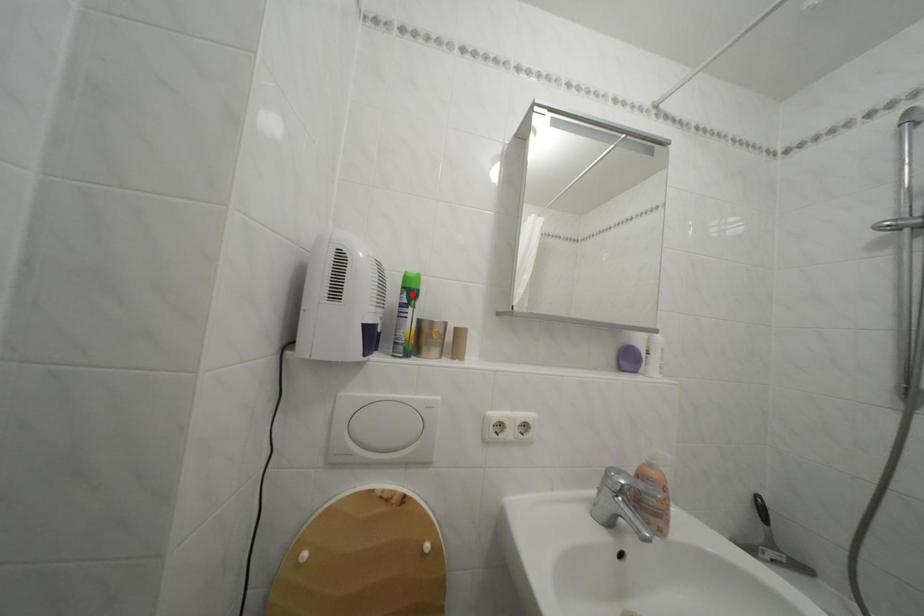
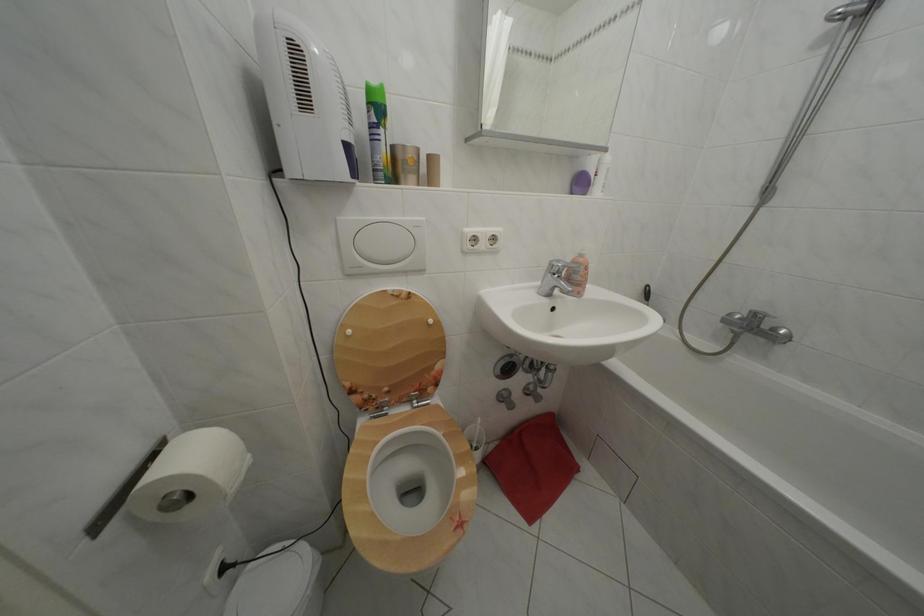
Locate, in the second image, the point that corresponds to the highlighted location in the first image.

(378, 110)